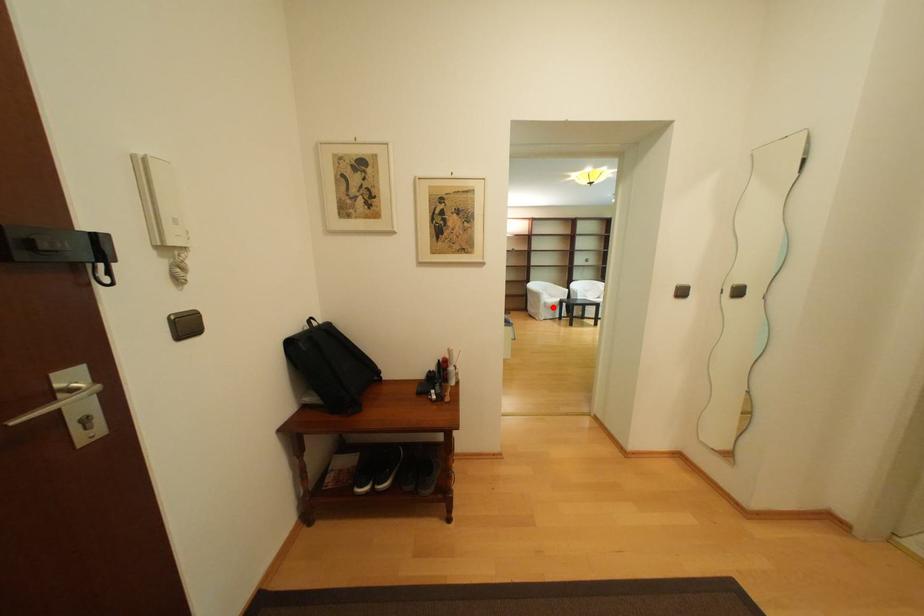
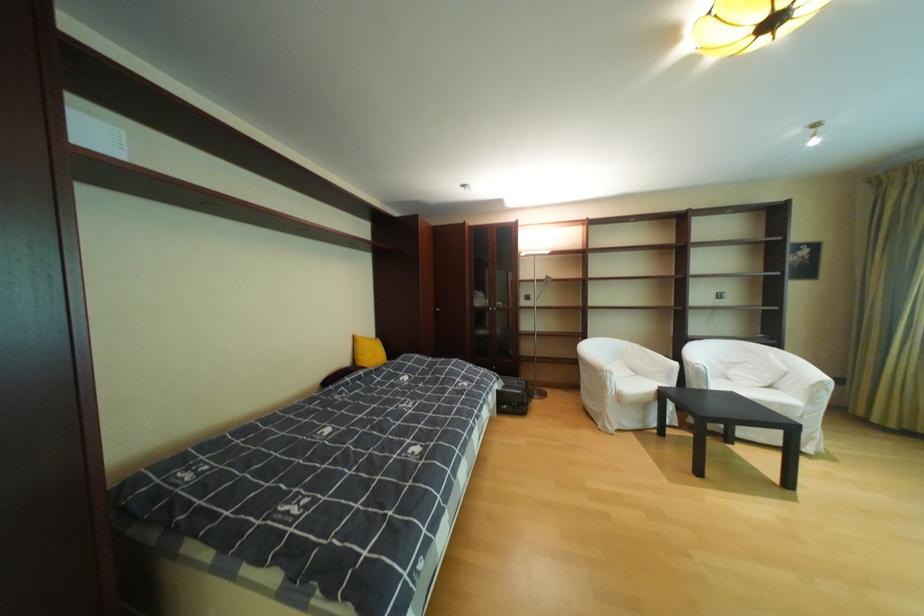
Question: I am providing you with two images of the same scene from different viewpoints. In image1, a red point is highlighted. Considering the same 3D point in image2, which of the following is correct?

Choices:
 (A) It is closer
 (B) It is farther

Answer: (A)